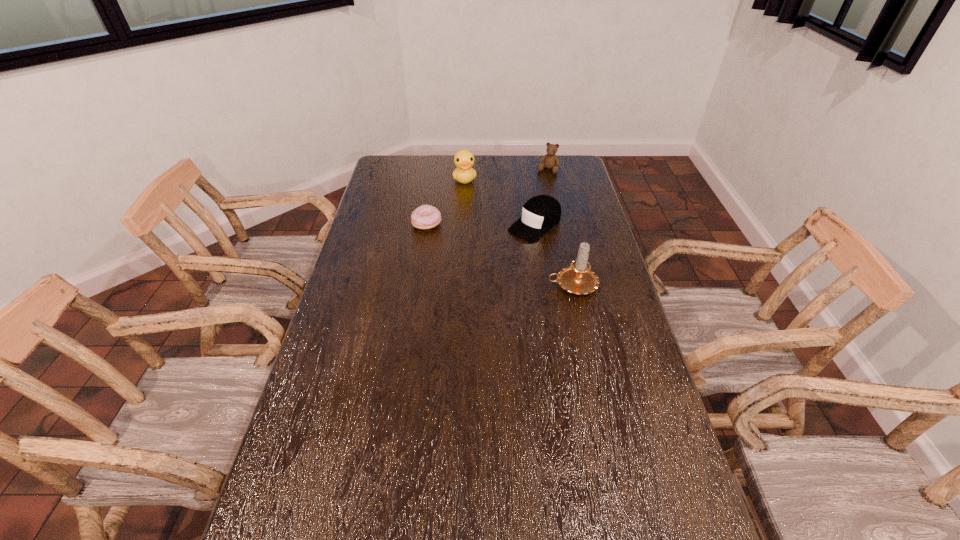
This screenshot has width=960, height=540. Find the location of `the shortest object`. the shortest object is located at coordinates 424,217.

At what (x,y) coordinates should I click in order to perform the action: click on the leftmost object. Please return your answer as a coordinate pair (x, y). The image size is (960, 540). Looking at the image, I should click on (424, 217).

The height and width of the screenshot is (540, 960). Identify the location of candle. (578, 278).

Identify the location of the tallest object. The image size is (960, 540). (578, 278).

Where is `the third tallest object`? the third tallest object is located at coordinates click(551, 161).

Find the location of a particular element. This screenshot has width=960, height=540. the second object from left to right is located at coordinates (464, 173).

Where is `duck`? This screenshot has width=960, height=540. duck is located at coordinates (464, 173).

The width and height of the screenshot is (960, 540). In order to click on cap in this screenshot , I will do `click(541, 213)`.

At what (x,y) coordinates should I click in order to perform the action: click on free spot located on the right of the shortest object. Please return your answer as a coordinate pair (x, y). This screenshot has height=540, width=960. Looking at the image, I should click on (516, 224).

Identify the location of free region located on the back of the candle. (557, 214).